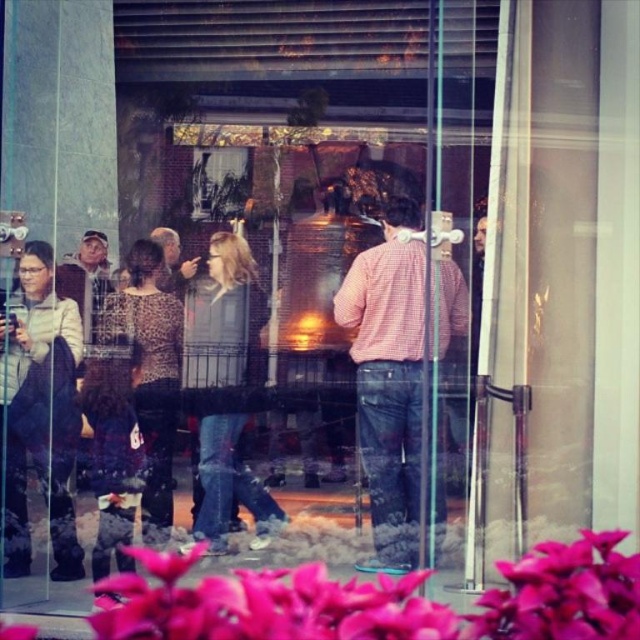
From the picture: Is pink matte leaves at lower center taller than pink checkered shirt at center?

Incorrect, pink matte leaves at lower center's height is not larger of pink checkered shirt at center's.

The image size is (640, 640). What do you see at coordinates (381, 600) in the screenshot?
I see `pink matte leaves at lower center` at bounding box center [381, 600].

The height and width of the screenshot is (640, 640). I want to click on pink matte leaves at lower center, so click(381, 600).

Can you confirm if pink checkered shirt at center is positioned to the right of matte black jacket at left?

Indeed, pink checkered shirt at center is positioned on the right side of matte black jacket at left.

Measure the distance from pink checkered shirt at center to matte black jacket at left.

pink checkered shirt at center is 1.27 meters from matte black jacket at left.

Find the location of a particular element. The image size is (640, 640). pink checkered shirt at center is located at coordinates (400, 380).

Locate an element on the screen. This screenshot has width=640, height=640. pink checkered shirt at center is located at coordinates (400, 380).

Between pink matte leaves at lower center and matte black jacket at left, which one appears on the left side from the viewer's perspective?

From the viewer's perspective, matte black jacket at left appears more on the left side.

Which is behind, point (621, 620) or point (92, 241)?

Positioned behind is point (92, 241).

In order to click on pink matte leaves at lower center in this screenshot , I will do `click(381, 600)`.